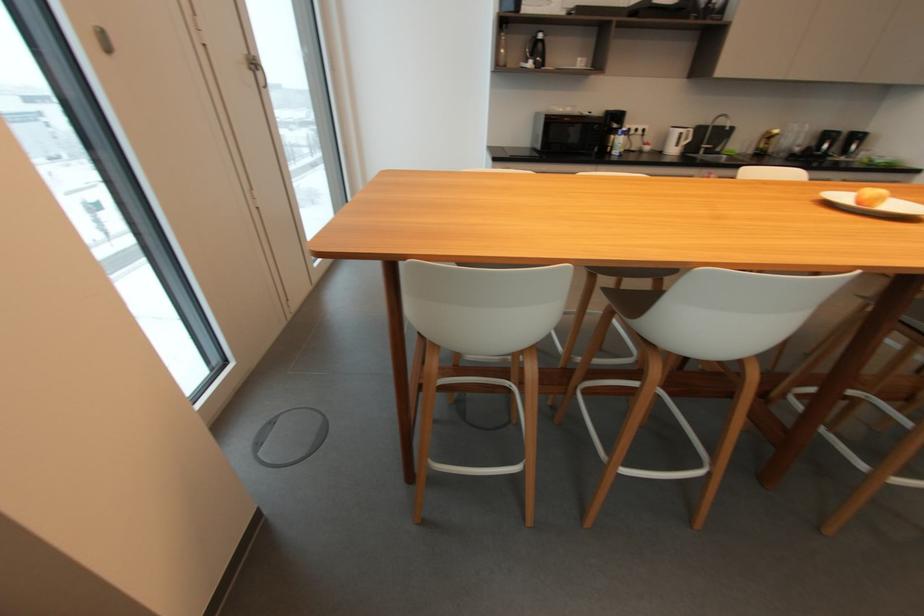
The location [676,140] corresponds to which object?

It corresponds to the white electric kettle in the image.